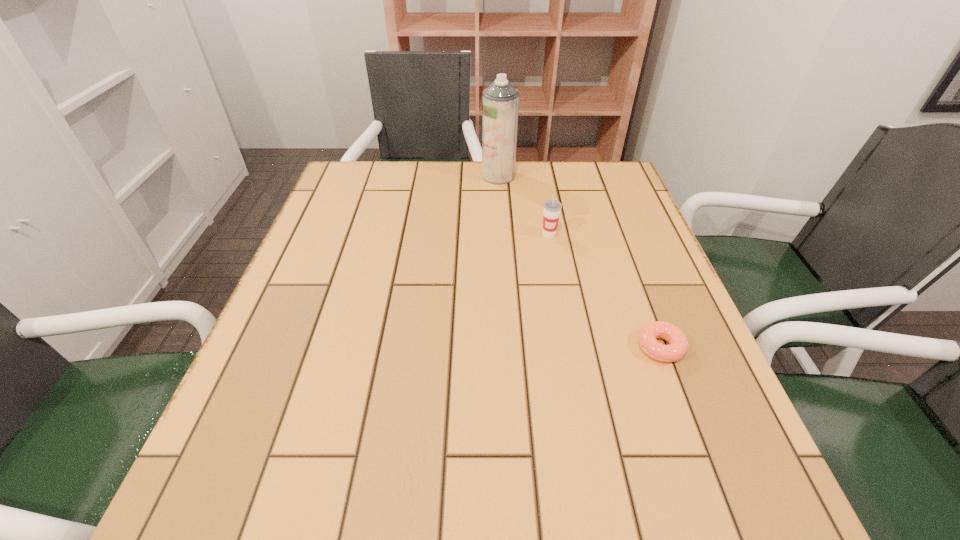
Find the location of `the farthest object`. the farthest object is located at coordinates (500, 102).

Locate an element on the screen. The image size is (960, 540). aerosol can is located at coordinates (500, 102).

The width and height of the screenshot is (960, 540). Identify the location of cup. (552, 208).

Locate an element on the screen. the second nearest object is located at coordinates (552, 208).

You are a GUI agent. You are given a task and a screenshot of the screen. Output one action in this format:
    pyautogui.click(x=<x>, y=<y>)
    Task: Click on the nearest object
    The height and width of the screenshot is (540, 960).
    Given the screenshot: What is the action you would take?
    pyautogui.click(x=678, y=344)

I want to click on the rightmost object, so click(678, 344).

I want to click on vacant region located 0.080m on the front of the tallest object, so click(x=500, y=200).

At what (x,y) coordinates should I click in order to perform the action: click on free region located 0.190m on the side of the cup with the logo. Please return your answer as a coordinate pair (x, y). Looking at the image, I should click on (561, 295).

This screenshot has height=540, width=960. In order to click on free space located 0.360m on the back of the shortest object in this screenshot , I will do `click(613, 222)`.

You are a GUI agent. You are given a task and a screenshot of the screen. Output one action in this format:
    pyautogui.click(x=<x>, y=<y>)
    Task: Click on the object that is at the far edge
    This screenshot has height=540, width=960.
    Given the screenshot: What is the action you would take?
    pyautogui.click(x=500, y=102)